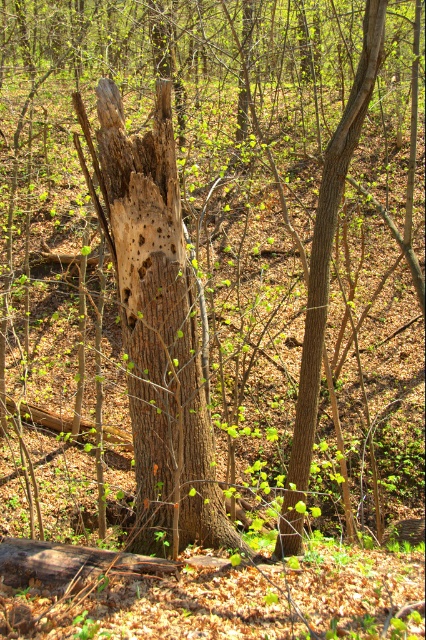
Question: Can you confirm if brown rough bark tree trunk at center is positioned to the right of smooth brown tree trunk at center?

Choices:
 (A) no
 (B) yes

Answer: (A)

Question: Which object is farther from the camera taking this photo?

Choices:
 (A) smooth brown tree trunk at center
 (B) brown rough bark tree trunk at center

Answer: (B)

Question: Is brown rough bark tree trunk at center to the right of smooth brown tree trunk at center from the viewer's perspective?

Choices:
 (A) no
 (B) yes

Answer: (A)

Question: Can you confirm if brown rough bark tree trunk at center is positioned to the left of smooth brown tree trunk at center?

Choices:
 (A) yes
 (B) no

Answer: (A)

Question: Which object is closer to the camera taking this photo?

Choices:
 (A) brown rough bark tree trunk at center
 (B) smooth brown tree trunk at center

Answer: (B)

Question: Among these points, which one is nearest to the camera?

Choices:
 (A) (316, 308)
 (B) (132, 349)

Answer: (A)